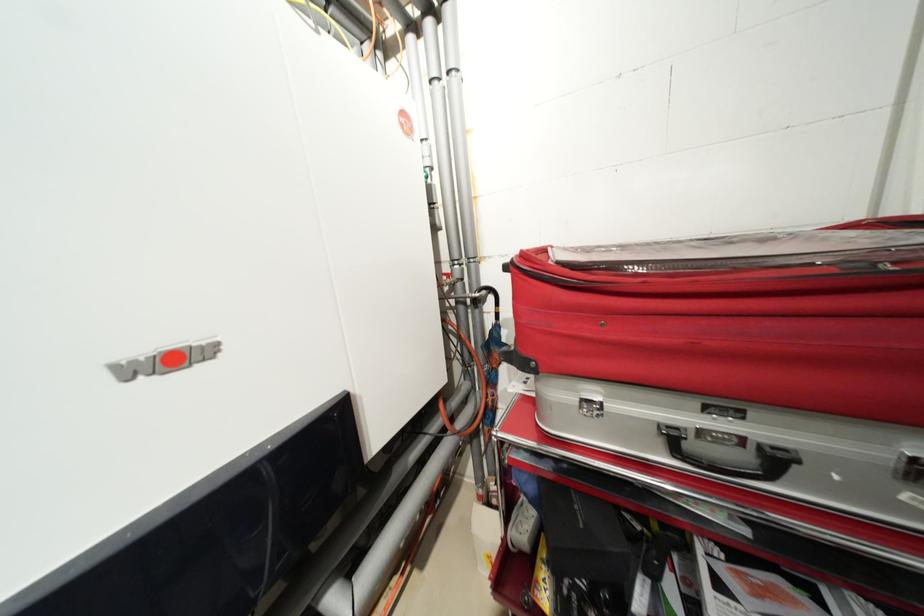
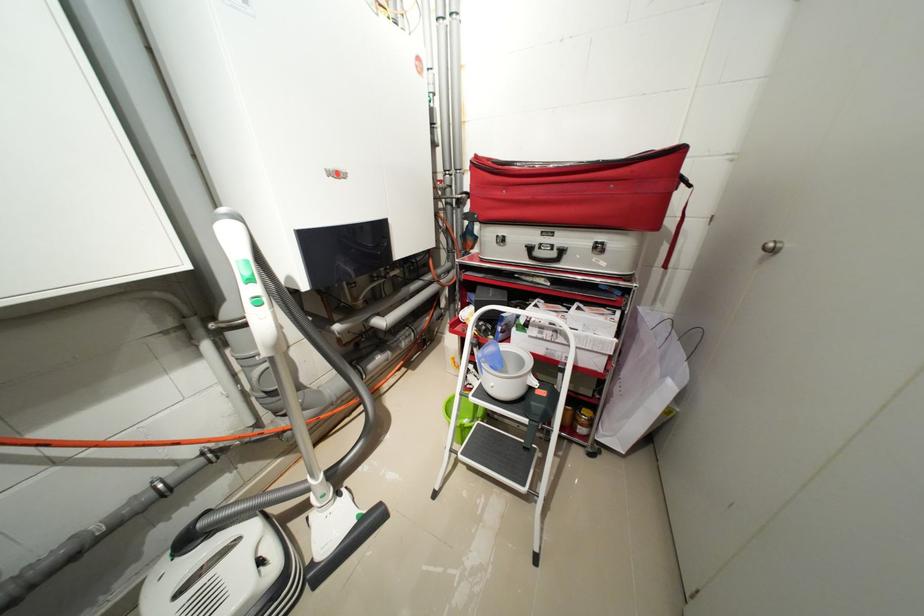
Question: The images are taken continuously from a first-person perspective. In which direction are you moving?

Choices:
 (A) Left
 (B) Right
 (C) Forward
 (D) Backward

Answer: (D)